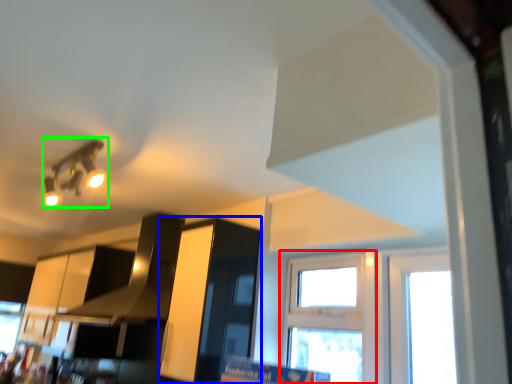
Question: Estimate the real-world distances between objects in this image. Which object is closer to window (highlighted by a red box), cabinetry (highlighted by a blue box) or light fixture (highlighted by a green box)?

Choices:
 (A) cabinetry
 (B) light fixture

Answer: (A)